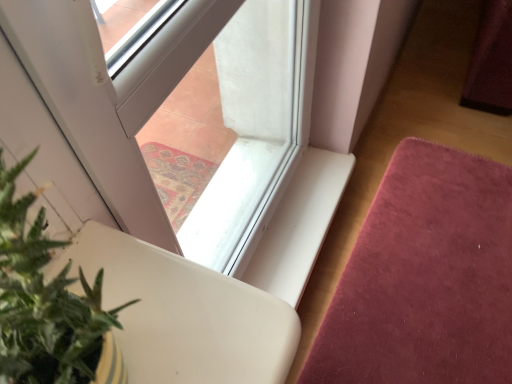
Find the location of a particular element. The width and height of the screenshot is (512, 384). empty space that is ontop of velvet pink mat at lower right (from a real-world perspective) is located at coordinates (443, 256).